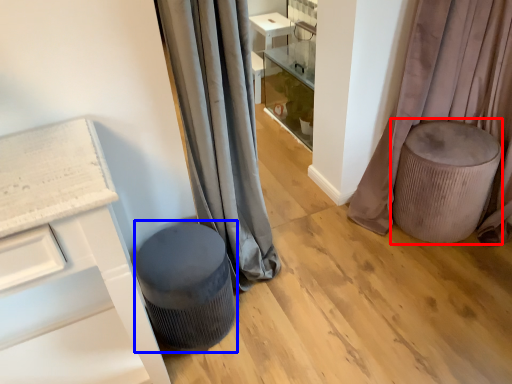
Question: Which object is closer to the camera taking this photo, swivel chair (highlighted by a red box) or music stool (highlighted by a blue box)?

Choices:
 (A) swivel chair
 (B) music stool

Answer: (B)